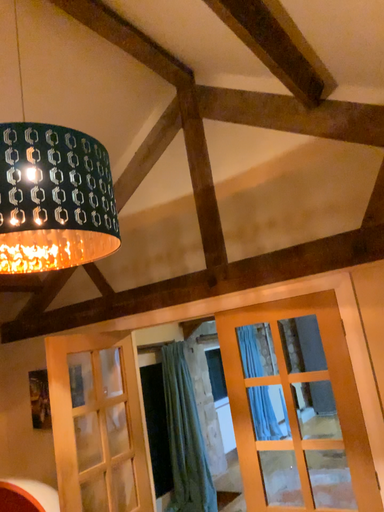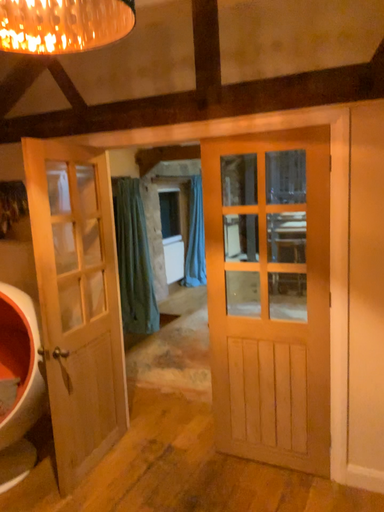
Question: How did the camera likely rotate when shooting the video?

Choices:
 (A) rotated upward
 (B) rotated downward

Answer: (B)